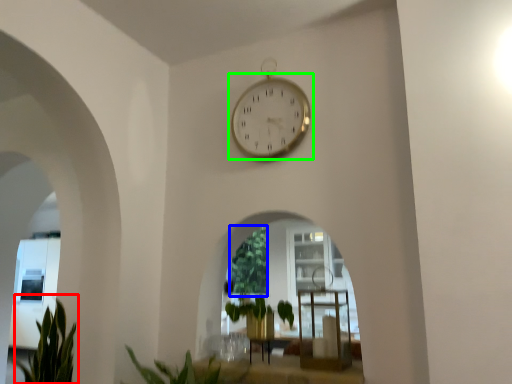
Question: Based on their relative distances, which object is nearer to plant (highlighted by a red box)? Choose from vegetation (highlighted by a blue box) and wall clock (highlighted by a green box).

Choices:
 (A) vegetation
 (B) wall clock

Answer: (A)